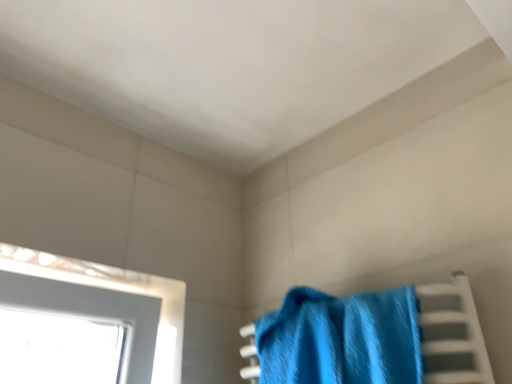
Describe the element at coordinates (341, 339) in the screenshot. I see `blue fuzzy towel at center` at that location.

In order to face blue fuzzy towel at center, should I rotate leftwards or rightwards?

Rotate right and turn 7.090 degrees.

Where is `blue fuzzy towel at center`? This screenshot has width=512, height=384. blue fuzzy towel at center is located at coordinates (341, 339).

You are a GUI agent. You are given a task and a screenshot of the screen. Output one action in this format:
    pyautogui.click(x=<x>, y=<y>)
    Task: Click on the blue fuzzy towel at center
    This screenshot has height=384, width=512.
    Given the screenshot: What is the action you would take?
    pyautogui.click(x=341, y=339)